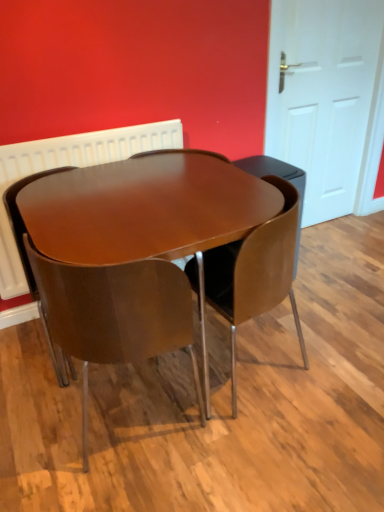
Where is `free point in front of white glossy door at right`? Image resolution: width=384 pixels, height=512 pixels. free point in front of white glossy door at right is located at coordinates (335, 250).